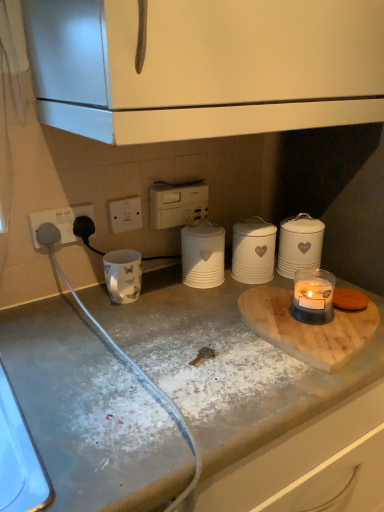
Locate an element on the screen. vacant area that is in front of white ceramic canister at center, which ranks as the 2th appliance in top-to-bottom order is located at coordinates (190, 312).